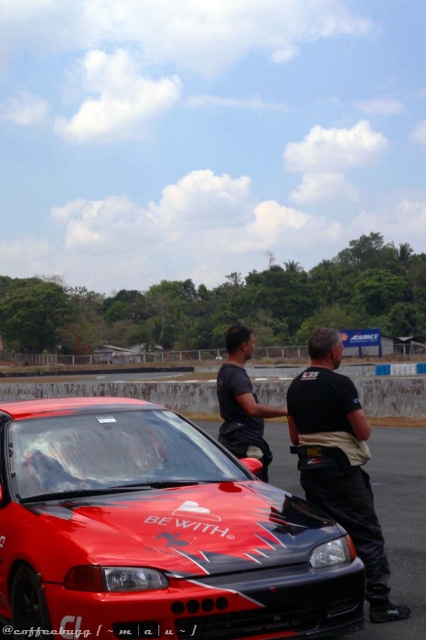
Question: Which point is closer to the camera taking this photo?

Choices:
 (A) (333, 360)
 (B) (258, 413)
 (C) (152, 634)
 (D) (206, 572)

Answer: (C)

Question: Is shiny red car at center above black matte shirt at center?

Choices:
 (A) yes
 (B) no

Answer: (A)

Question: Can you confirm if shiny red car at center is positioned below black leather jacket at center?

Choices:
 (A) yes
 (B) no

Answer: (A)

Question: Is the position of shiny red car at center less distant than that of black matte shirt at center?

Choices:
 (A) no
 (B) yes

Answer: (B)

Question: Which point is farther to the camera?

Choices:
 (A) (157, 636)
 (B) (135, 570)

Answer: (B)

Question: Which object appears closest to the camera in this image?

Choices:
 (A) shiny red car at center
 (B) black plastic license plate at center
 (C) black matte shirt at center

Answer: (B)